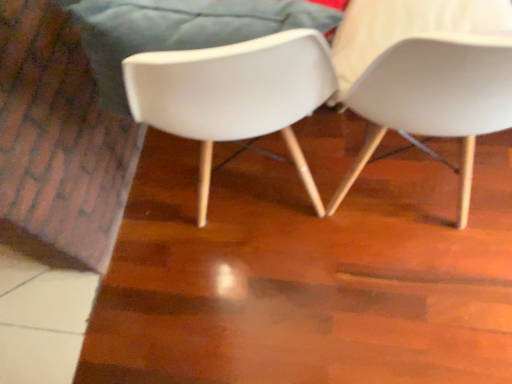
Identify the location of free spot below white plastic chair at right, arranged as the first chair when viewed from the right (from a real-world perspective). This screenshot has width=512, height=384. (402, 185).